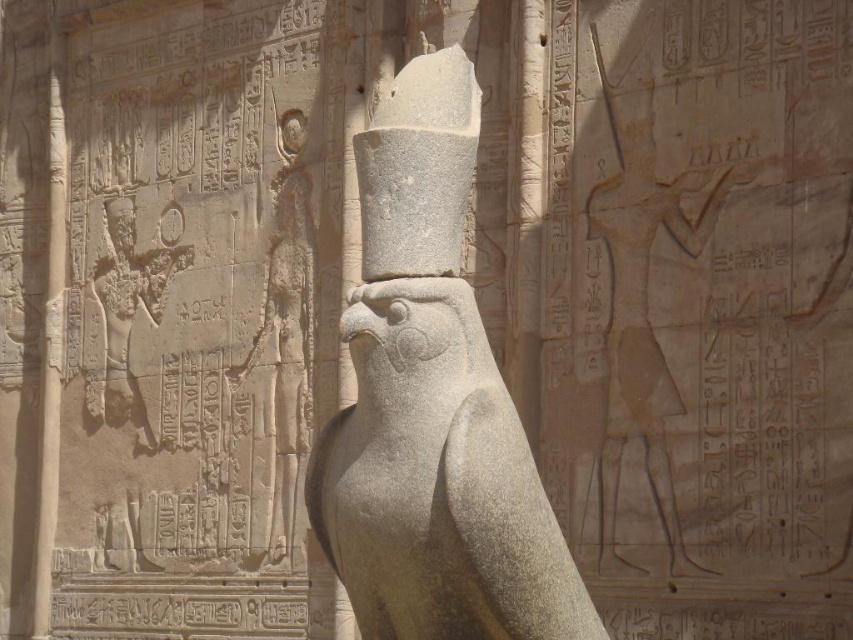
You are an archaeologist examining the ancient Egyptian statue. You need to determine the exact location of the smooth stone statue at center. What are its coordinates?

The smooth stone statue at center is located at coordinates point (645, 316).

You are an archaeologist standing in front of the ancient Egyptian statue scene. You see the smooth stone statue at center and the gray stone statue at center. Which statue is closer to you?

Both the smooth stone statue at center and the gray stone statue at center are positioned at the same central area, so they are equidistant from you. However, according to the description, the smooth stone statue at center is 2.49 meters away from the gray stone statue at center, meaning they are separate statues placed near each other but not exactly at the same spot.

From the picture: You are an archaeologist examining a wall with two statues. You see the smooth stone statue at center and the matte stone pharaoh at left. Which statue is positioned to the right of the other?

The smooth stone statue at center is positioned to the right of the matte stone pharaoh at left.